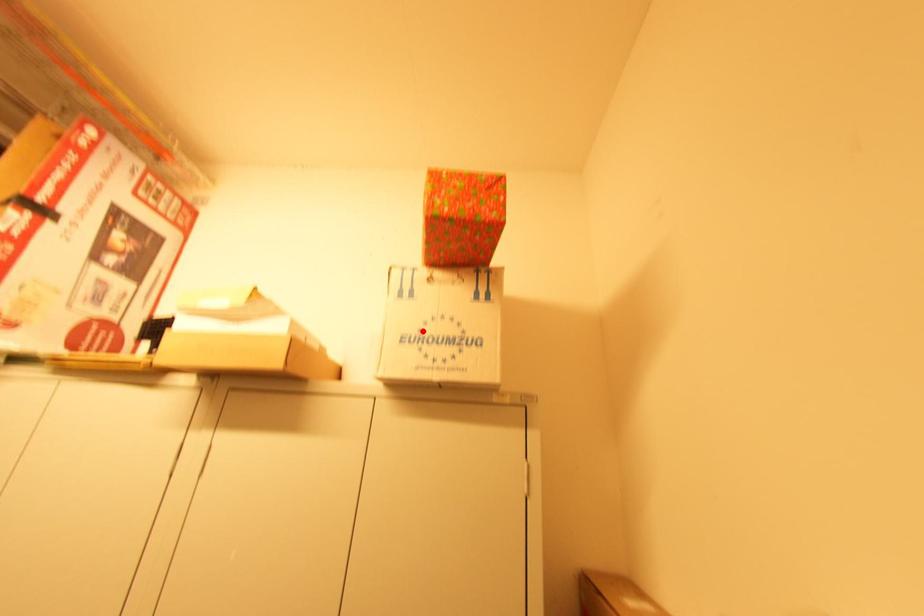
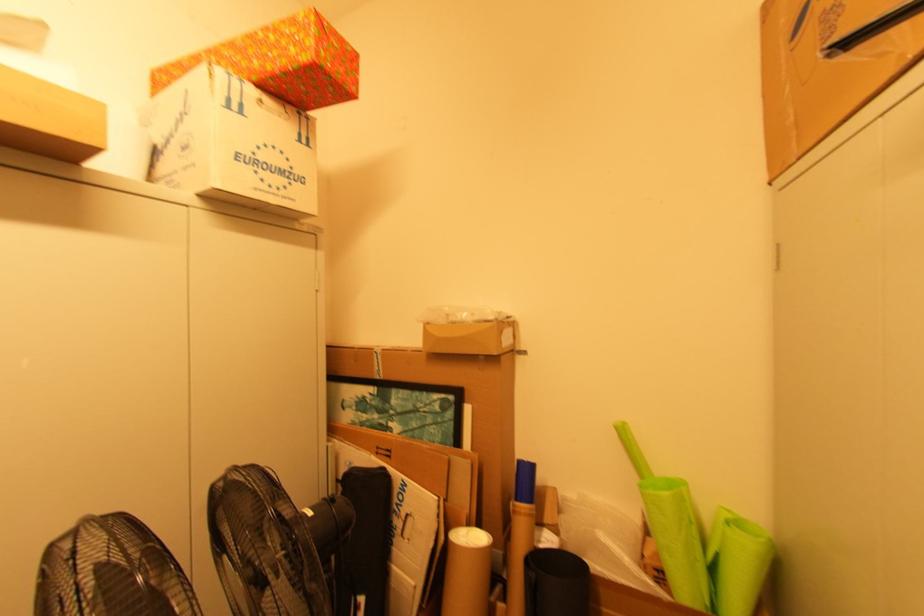
Locate, in the second image, the point that corresponds to the highlighted location in the first image.

(257, 154)